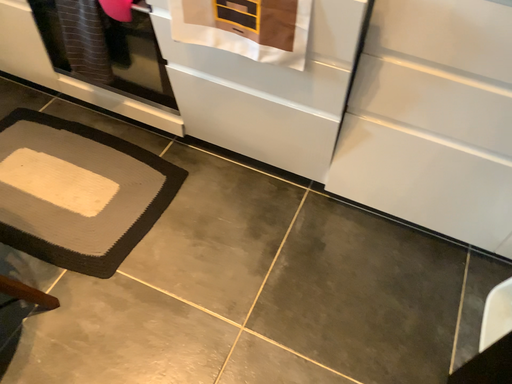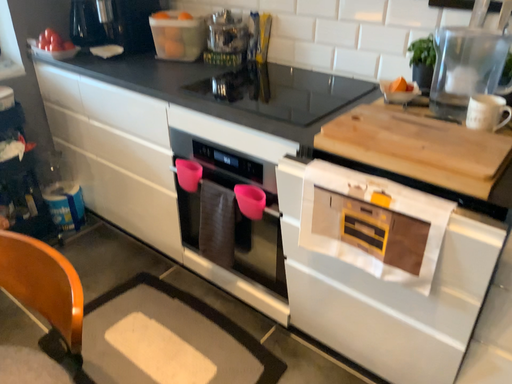
Question: Which way did the camera rotate in the video?

Choices:
 (A) rotated upward
 (B) rotated downward

Answer: (A)